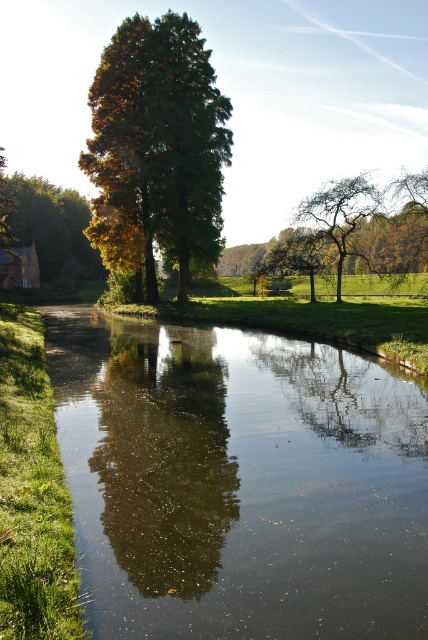
You are an artist sketching the landscape and want to ensure the trees are proportionally accurate. Which tree should you draw first to establish the scale of the scene, the green matte tree at center or the green matte tree at upper center?

You should draw the green matte tree at upper center first because it is larger in size compared to the green matte tree at center, helping to establish the scale of the scene.

You are a surveyor measuring the distance between two landmarks in a natural setting. You have a measuring tape that can extend up to 30 meters. You need to measure the distance between the smooth reflective water at center and the green matte tree at center. Can your measuring tape reach that distance?

The distance between the smooth reflective water at center and the green matte tree at center is 33.82 meters, which is longer than the 30 meters your measuring tape can extend. Therefore, your measuring tape cannot reach the full distance between them.

You are standing on the grassy bank on the left side of the image. You want to take a photo that includes both the smooth reflective water at center and the green matte tree at upper center. Which object will appear smaller in the photo?

The smooth reflective water at center will appear smaller in the photo because it has a lesser height compared to the green matte tree at upper center.